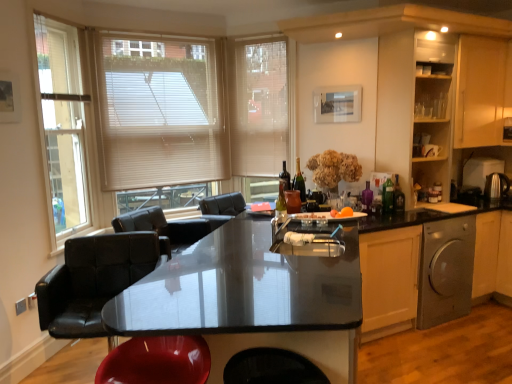
Question: Is wooden cabinet at upper right, the 2th cabinetry from the left, positioned far away from glossy black countertop at center?

Choices:
 (A) no
 (B) yes

Answer: (B)

Question: Considering the relative sizes of wooden cabinet at upper right, the 1th cabinetry in the right-to-left sequence, and glossy black countertop at center in the image provided, is wooden cabinet at upper right, the 1th cabinetry in the right-to-left sequence, shorter than glossy black countertop at center?

Choices:
 (A) yes
 (B) no

Answer: (B)

Question: Is wooden cabinet at upper right, the 1th cabinetry in the right-to-left sequence, further to camera compared to glossy black countertop at center?

Choices:
 (A) no
 (B) yes

Answer: (B)

Question: Does wooden cabinet at upper right, the 1th cabinetry in the right-to-left sequence, have a greater width compared to glossy black countertop at center?

Choices:
 (A) yes
 (B) no

Answer: (B)

Question: From the image's perspective, is wooden cabinet at upper right, the 1th cabinetry in the right-to-left sequence, located beneath glossy black countertop at center?

Choices:
 (A) yes
 (B) no

Answer: (B)

Question: From a real-world perspective, is translucent glass bottle at center, which is the second bottle from right to left, physically located above or below orange matte fruit at center?

Choices:
 (A) below
 (B) above

Answer: (B)

Question: Considering the positions of translucent glass bottle at center, which is the second bottle from right to left, and orange matte fruit at center in the image, is translucent glass bottle at center, which is the second bottle from right to left, wider or thinner than orange matte fruit at center?

Choices:
 (A) wide
 (B) thin

Answer: (B)

Question: From the image's perspective, is translucent glass bottle at center, acting as the second bottle starting from the back, positioned above or below orange matte fruit at center?

Choices:
 (A) below
 (B) above

Answer: (B)

Question: In terms of size, does translucent glass bottle at center, arranged as the second bottle when viewed from the front, appear bigger or smaller than orange matte fruit at center?

Choices:
 (A) small
 (B) big

Answer: (A)

Question: Considering the relative positions of orange matte fruit at center and shiny red swivel chair at lower left in the image provided, is orange matte fruit at center to the left or to the right of shiny red swivel chair at lower left?

Choices:
 (A) left
 (B) right

Answer: (B)

Question: From a real-world perspective, is orange matte fruit at center positioned above or below shiny red swivel chair at lower left?

Choices:
 (A) below
 (B) above

Answer: (B)

Question: From the image's perspective, is orange matte fruit at center above or below shiny red swivel chair at lower left?

Choices:
 (A) below
 (B) above

Answer: (B)

Question: Choose the correct answer: Is orange matte fruit at center inside shiny red swivel chair at lower left or outside it?

Choices:
 (A) inside
 (B) outside

Answer: (B)

Question: From a real-world perspective, is shiny dark glass wine bottle at center positioned above or below beige fabric blind at upper center?

Choices:
 (A) below
 (B) above

Answer: (A)

Question: Is shiny dark glass wine bottle at center taller or shorter than beige fabric blind at upper center?

Choices:
 (A) tall
 (B) short

Answer: (B)